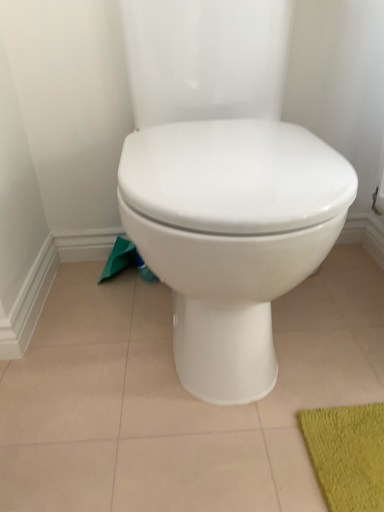
The height and width of the screenshot is (512, 384). I want to click on green fabric toilet paper at lower left, so click(x=125, y=261).

This screenshot has width=384, height=512. What do you see at coordinates (125, 261) in the screenshot?
I see `green fabric toilet paper at lower left` at bounding box center [125, 261].

The height and width of the screenshot is (512, 384). Describe the element at coordinates (231, 236) in the screenshot. I see `white glossy toilet at center` at that location.

You are a GUI agent. You are given a task and a screenshot of the screen. Output one action in this format:
    pyautogui.click(x=<x>, y=<y>)
    Task: Click on the white glossy toilet at center
    
    Given the screenshot: What is the action you would take?
    pyautogui.click(x=231, y=236)

Measure the distance between white glossy toilet at center and camera.

49.28 centimeters.

Identify the location of green fabric toilet paper at lower left. (125, 261).

From the picture: Considering the positions of objects white glossy toilet at center and green fabric toilet paper at lower left in the image provided, who is more to the left, white glossy toilet at center or green fabric toilet paper at lower left?

From the viewer's perspective, green fabric toilet paper at lower left appears more on the left side.

Is white glossy toilet at center in front of or behind green fabric toilet paper at lower left in the image?

white glossy toilet at center is positioned closer to the viewer than green fabric toilet paper at lower left.

Between point (237, 154) and point (121, 244), which one is positioned in front?

The point (237, 154) is closer.

Based on the photo, from the image's perspective, which is above, white glossy toilet at center or green fabric toilet paper at lower left?

white glossy toilet at center appears higher in the image.

From a real-world perspective, is white glossy toilet at center on green fabric toilet paper at lower left?

Yes, from a real-world perspective, white glossy toilet at center is over green fabric toilet paper at lower left

Which object is thinner, white glossy toilet at center or green fabric toilet paper at lower left?

With smaller width is green fabric toilet paper at lower left.

Is white glossy toilet at center taller than green fabric toilet paper at lower left?

Yes.

Which of these two, white glossy toilet at center or green fabric toilet paper at lower left, is smaller?

With smaller size is green fabric toilet paper at lower left.

Can green fabric toilet paper at lower left be found inside white glossy toilet at center?

No.

Is white glossy toilet at center placed right next to green fabric toilet paper at lower left?

No, white glossy toilet at center is not beside green fabric toilet paper at lower left.

Looking at this image, does white glossy toilet at center turn towards green fabric toilet paper at lower left?

No, white glossy toilet at center does not turn towards green fabric toilet paper at lower left.

What are the coordinates of `toilet paper below the white glossy toilet at center (from the image's perspective)` in the screenshot? It's located at (125, 261).

Which object is positioned more to the right, green fabric toilet paper at lower left or white glossy toilet at center?

Positioned to the right is white glossy toilet at center.

Considering their positions, is green fabric toilet paper at lower left located in front of or behind white glossy toilet at center?

In the image, green fabric toilet paper at lower left appears behind white glossy toilet at center.

Between point (146, 267) and point (251, 189), which one is positioned in front?

The point (251, 189) is more forward.

From the image's perspective, does green fabric toilet paper at lower left appear lower than white glossy toilet at center?

Correct, green fabric toilet paper at lower left appears lower than white glossy toilet at center in the image.

From a real-world perspective, who is located lower, green fabric toilet paper at lower left or white glossy toilet at center?

green fabric toilet paper at lower left is physically lower.

In terms of width, does green fabric toilet paper at lower left look wider or thinner when compared to white glossy toilet at center?

Clearly, green fabric toilet paper at lower left has less width compared to white glossy toilet at center.

Can you confirm if green fabric toilet paper at lower left is shorter than white glossy toilet at center?

Correct, green fabric toilet paper at lower left is not as tall as white glossy toilet at center.

Based on their sizes in the image, would you say green fabric toilet paper at lower left is bigger or smaller than white glossy toilet at center?

Considering their sizes, green fabric toilet paper at lower left takes up less space than white glossy toilet at center.

Is green fabric toilet paper at lower left outside of white glossy toilet at center?

Yes, green fabric toilet paper at lower left is located beyond the bounds of white glossy toilet at center.

Are green fabric toilet paper at lower left and white glossy toilet at center far apart?

Actually, green fabric toilet paper at lower left and white glossy toilet at center are a little close together.

Could you tell me if green fabric toilet paper at lower left is turned towards white glossy toilet at center?

No, green fabric toilet paper at lower left does not turn towards white glossy toilet at center.

How many degrees apart are the facing directions of green fabric toilet paper at lower left and white glossy toilet at center?

There is a 0.8-degree angle between the facing directions of green fabric toilet paper at lower left and white glossy toilet at center.

How much distance is there between green fabric toilet paper at lower left and white glossy toilet at center?

green fabric toilet paper at lower left and white glossy toilet at center are 48.65 centimeters apart.

I want to click on toilet that appears in front of the green fabric toilet paper at lower left, so click(x=231, y=236).

Where is `toilet on the right of green fabric toilet paper at lower left`? This screenshot has height=512, width=384. toilet on the right of green fabric toilet paper at lower left is located at coordinates (231, 236).

The image size is (384, 512). What are the coordinates of `toilet paper located underneath the white glossy toilet at center (from a real-world perspective)` in the screenshot? It's located at [x=125, y=261].